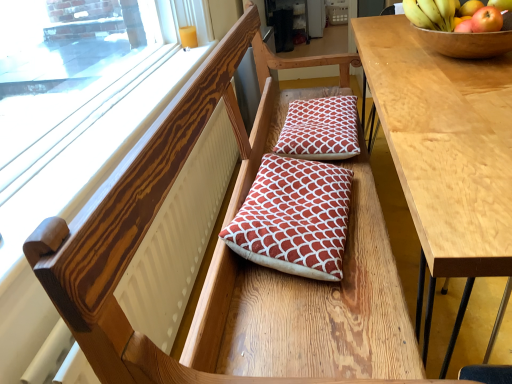
Question: Considering the positions of wooden frame at upper left and wooden bowl at upper right in the image, is wooden frame at upper left bigger or smaller than wooden bowl at upper right?

Choices:
 (A) big
 (B) small

Answer: (A)

Question: Relative to wooden bowl at upper right, is wooden frame at upper left in front or behind?

Choices:
 (A) front
 (B) behind

Answer: (A)

Question: Which object is positioned closest to the red quilted cushion at center, the first pillow viewed from the back?

Choices:
 (A) red textured cushion at center, the 1th pillow in the front-to-back sequence
 (B) red matte apple at upper right
 (C) light brown wood table at right
 (D) yellow matte bananas at upper right
 (E) wooden frame at upper left

Answer: (A)

Question: Estimate the real-world distances between objects in this image. Which object is farther from the red textured cushion at center, which is the second pillow from back to front?

Choices:
 (A) red quilted cushion at center, the 2th pillow from the bottom
 (B) yellow matte bananas at upper right
 (C) light brown wood table at right
 (D) wooden bowl at upper right
 (E) red matte apple at upper right

Answer: (E)